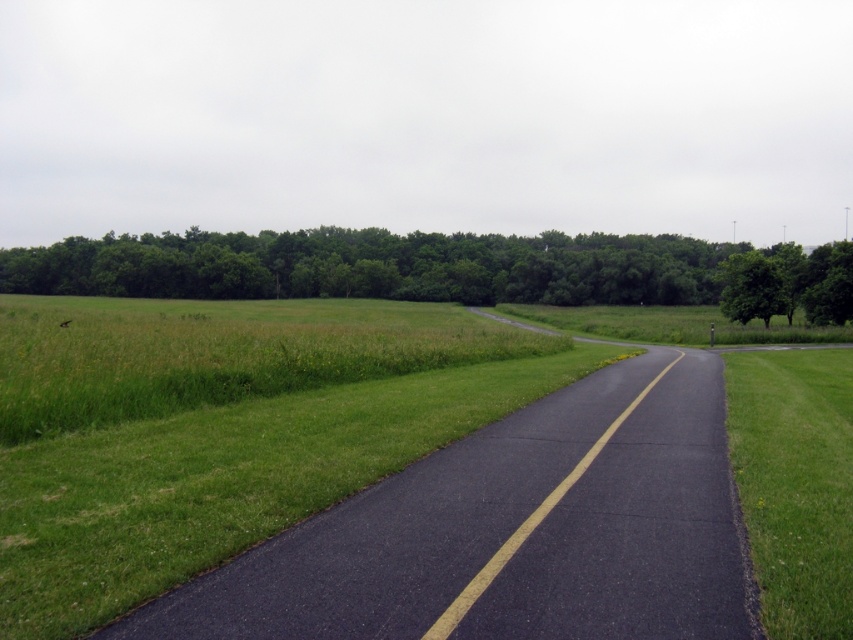
Which is in front, point (755, 269) or point (724, 273)?

Point (755, 269)

The width and height of the screenshot is (853, 640). Identify the location of green leafy tree at center. tap(444, 269).

Identify the location of green leafy tree at center. (444, 269).

Does green grass at center appear on the left side of green leafy tree at right?

Yes, green grass at center is to the left of green leafy tree at right.

Who is positioned more to the right, green grass at center or green leafy tree at right?

Positioned to the right is green leafy tree at right.

The width and height of the screenshot is (853, 640). In order to click on green grass at center in this screenshot , I will do `click(219, 428)`.

Is green leafy tree at center shorter than green grass at right?

No.

The height and width of the screenshot is (640, 853). I want to click on green leafy tree at center, so click(444, 269).